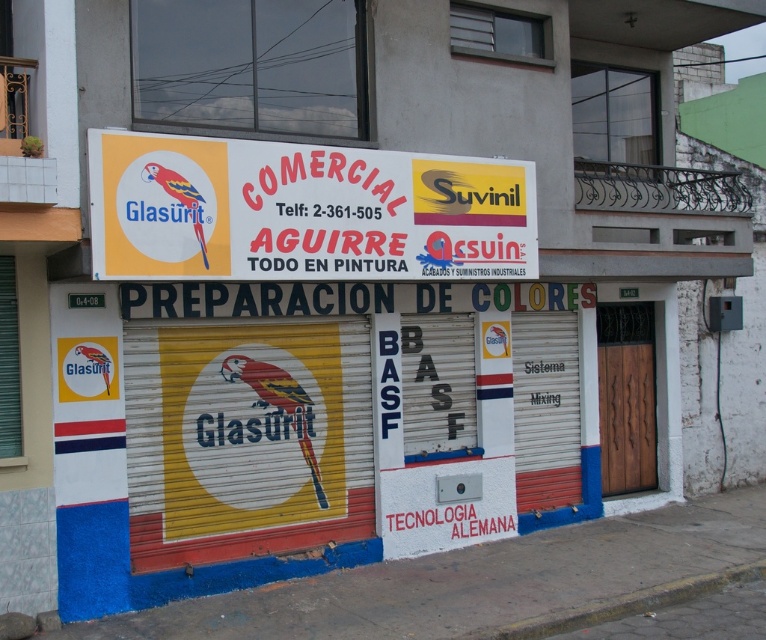
Which of these two, white plastic sign at upper center or concrete at lower center, stands taller?

With more height is white plastic sign at upper center.

Is white plastic sign at upper center shorter than concrete at lower center?

No.

Is point (466, 184) positioned before point (512, 624)?

No, it is behind (512, 624).

Where is `white plastic sign at upper center`? The width and height of the screenshot is (766, 640). white plastic sign at upper center is located at coordinates (303, 211).

Is wooden door at right positioned before concrete at lower center?

That is False.

In the scene shown: Does wooden door at right have a smaller size compared to concrete at lower center?

Incorrect, wooden door at right is not smaller in size than concrete at lower center.

Is point (606, 323) positioned behind point (650, 605)?

Yes, point (606, 323) is behind point (650, 605).

Locate an element on the screen. The height and width of the screenshot is (640, 766). wooden door at right is located at coordinates (627, 396).

Can you confirm if white plastic sign at upper center is taller than wooden door at right?

No, white plastic sign at upper center is not taller than wooden door at right.

Can you confirm if white plastic sign at upper center is smaller than wooden door at right?

No.

Which is behind, point (95, 241) or point (609, 323)?

The point (609, 323) is more distant.

The height and width of the screenshot is (640, 766). Find the location of `white plastic sign at upper center`. white plastic sign at upper center is located at coordinates (303, 211).